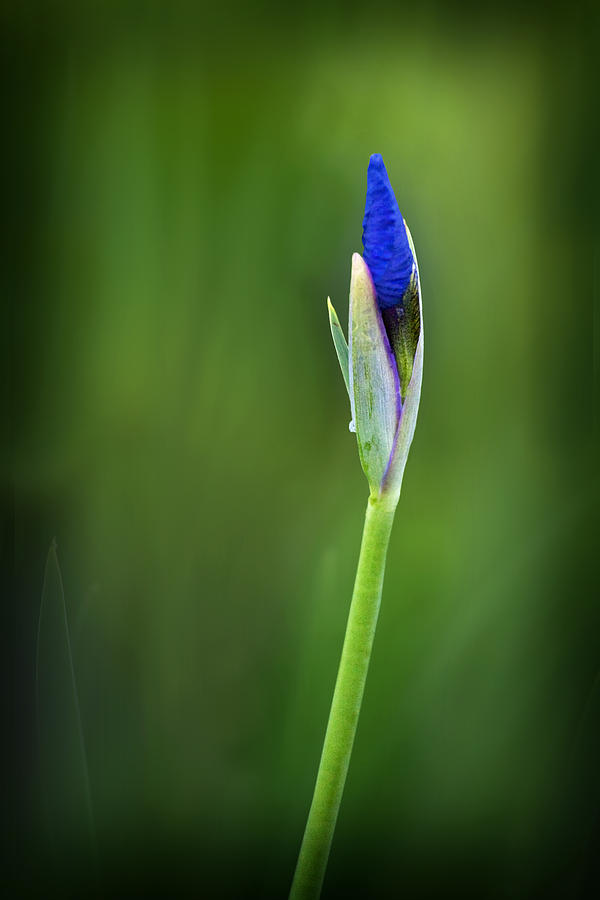
Where is `plant`? plant is located at coordinates (371, 518).